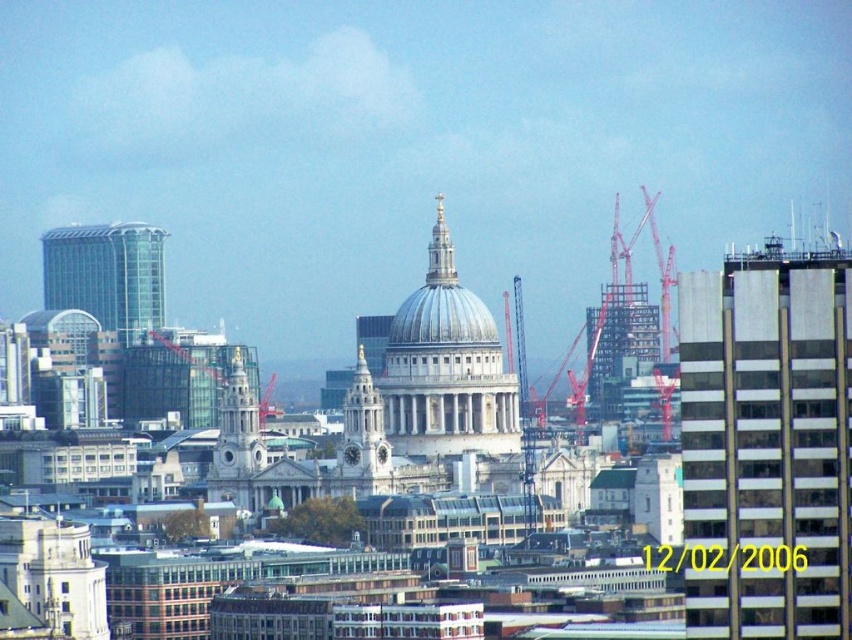
Is point (747, 355) behind point (447, 298)?

Yes.

Does point (798, 486) come in front of point (459, 337)?

No, (798, 486) is behind (459, 337).

Find the location of a particular element. This screenshot has width=852, height=640. glassy reflective building at right is located at coordinates pyautogui.click(x=767, y=445).

Which is more to the right, white marble dome at center or shiny silver dome at center?

white marble dome at center

Is white marble dome at center above shiny silver dome at center?

No, white marble dome at center is not above shiny silver dome at center.

This screenshot has width=852, height=640. I want to click on white marble dome at center, so click(x=438, y=371).

Which is behind, point (721, 488) or point (448, 396)?

The point (721, 488) is behind.

Can you confirm if glassy reflective building at right is positioned to the right of white marble dome at center?

Yes, glassy reflective building at right is to the right of white marble dome at center.

The height and width of the screenshot is (640, 852). Describe the element at coordinates (767, 445) in the screenshot. I see `glassy reflective building at right` at that location.

This screenshot has width=852, height=640. In order to click on glassy reflective building at right in this screenshot , I will do `click(767, 445)`.